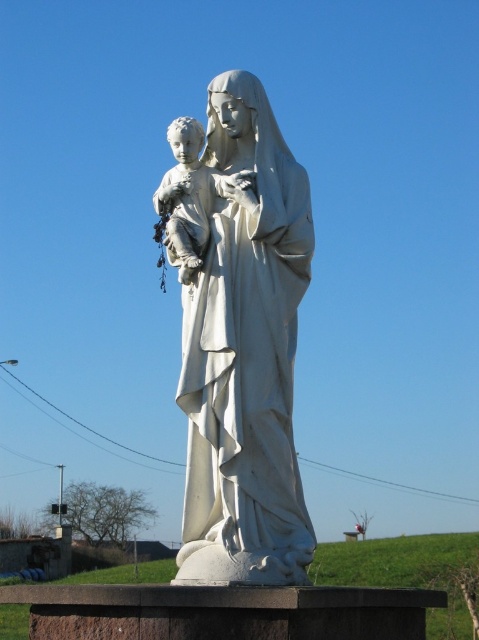
This screenshot has height=640, width=479. Find the location of `white marble statue at center`. white marble statue at center is located at coordinates (239, 337).

Is point (185, 573) more distant than point (216, 186)?

No, it is not.

Locate an element on the screen. This screenshot has height=640, width=479. white marble statue at center is located at coordinates pos(239,337).